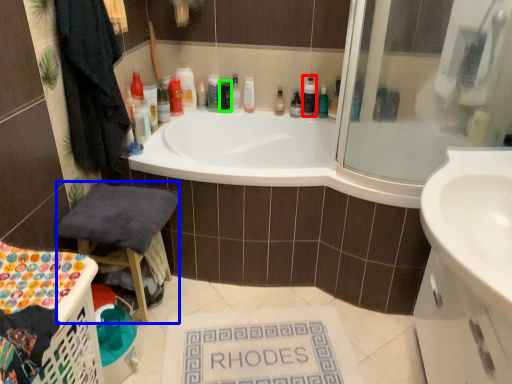
Question: Which object is positioned closest to cleaning product (highlighted by a red box)? Select from chair (highlighted by a blue box) and toiletry (highlighted by a green box).

Choices:
 (A) chair
 (B) toiletry

Answer: (B)